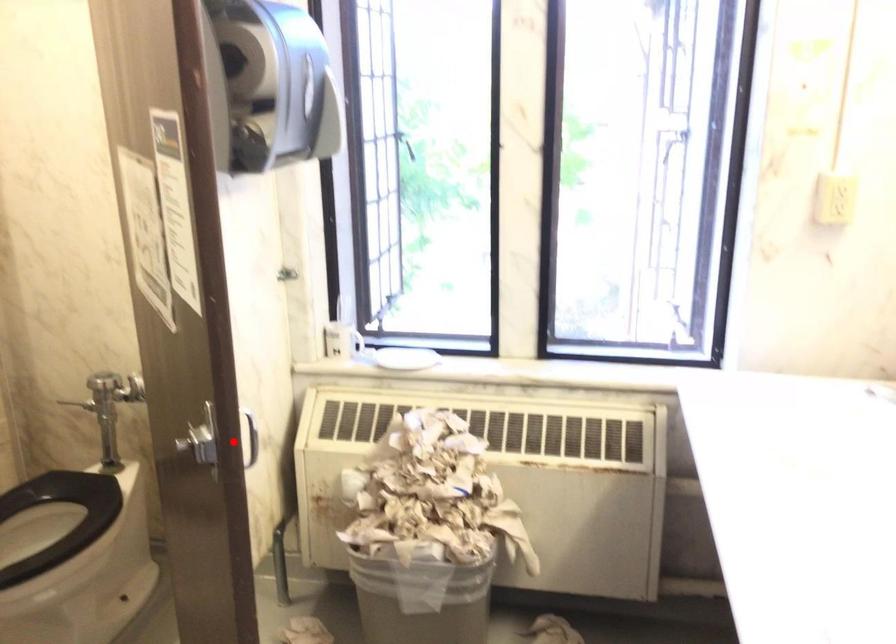
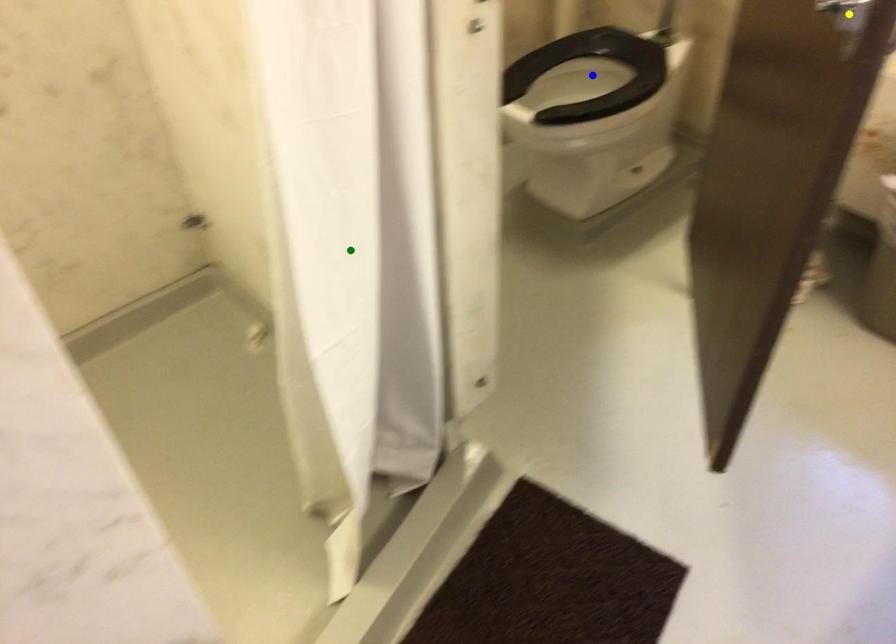
Question: I am providing you with two images of the same scene from different viewpoints. A red point is marked on the first image. You are given multiple points on the second image. Which point in image 2 is actually the same real-world point as the red point in image 1?

Choices:
 (A) blue point
 (B) yellow point
 (C) green point

Answer: (B)